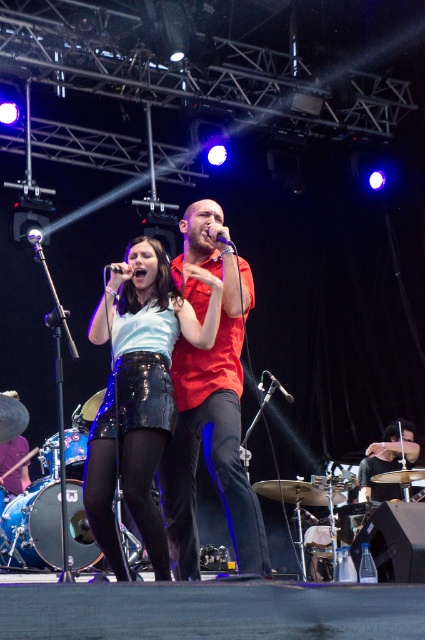
You are a stagehand adjusting the lighting for the performance. You need to ensure that the shiny black skirt at center and the black matte microphone at center are both visible under the spotlight. Since the spotlight can only focus on one object at a time, which object should you focus on first to ensure the taller one is properly lit?

The shiny black skirt at center is taller than the black matte microphone at center, so you should focus the spotlight on the shiny black skirt at center first to ensure it is properly lit.

You are a stagehand adjusting the lighting for the performers. You need to ensure that the shiny black skirt at center and the matte red shirt at center are both well illuminated. Given their sizes, which object requires a smaller spotlight to be properly lit?

The shiny black skirt at center has a smaller size compared to the matte red shirt at center, so the shiny black skirt at center requires a smaller spotlight to be properly lit.

You are a stagehand who needs to place a 10 inch wide decorative panel between the shiny black skirt at center and the matte red shirt at center. Is there enough space between them to fit the panel?

The shiny black skirt at center is 8.53 inches from matte red shirt at center. Since the distance between them is less than 10 inches, the decorative panel cannot be placed between them.